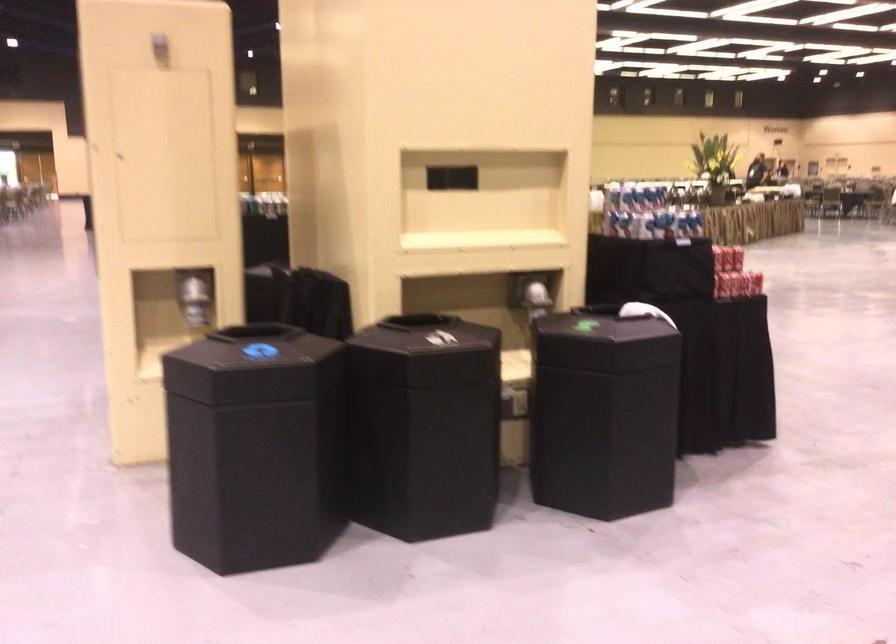
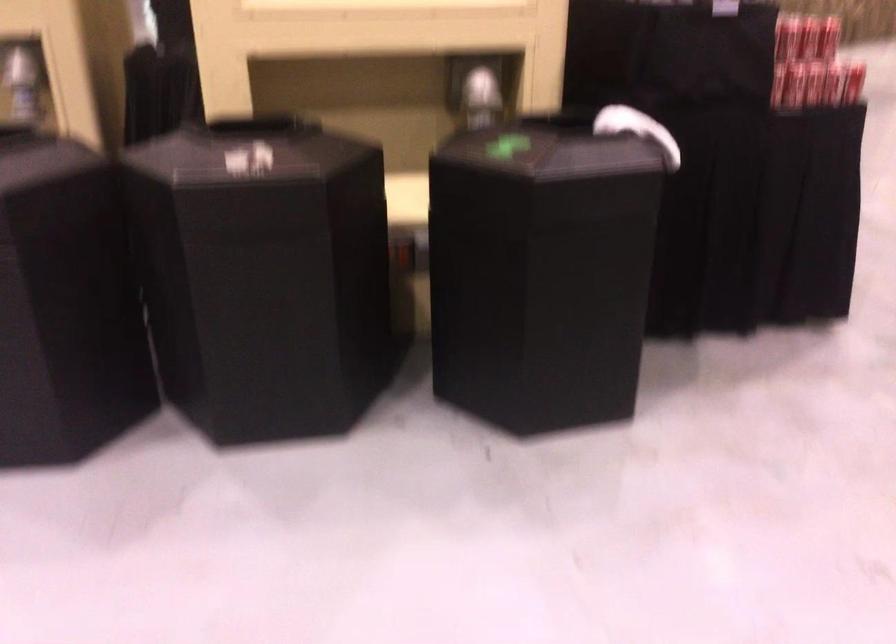
Where in the second image is the point corresponding to (437,337) from the first image?

(271, 154)